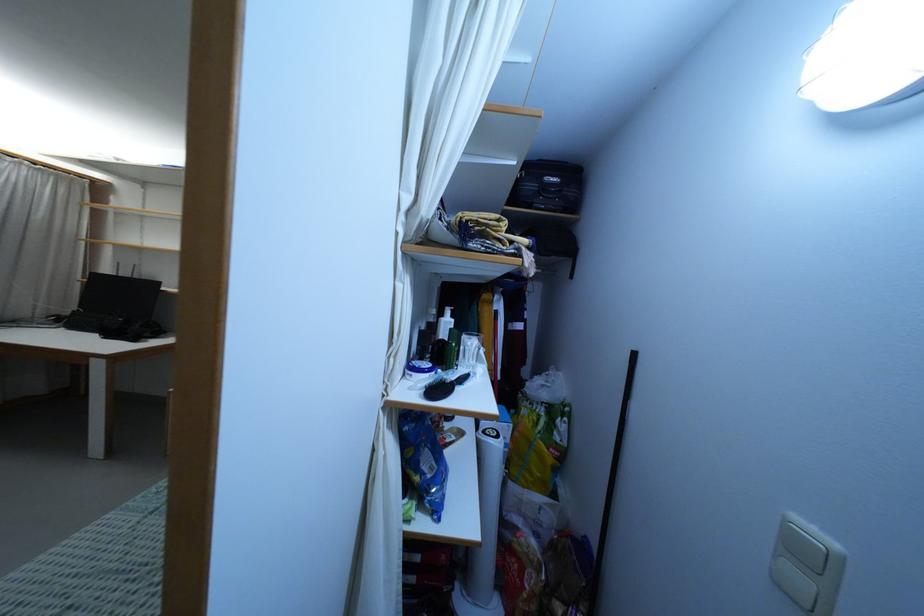
Find where to grasp the black hairbrush. Please return your answer as a coordinate pair (x, y).

(444, 386)